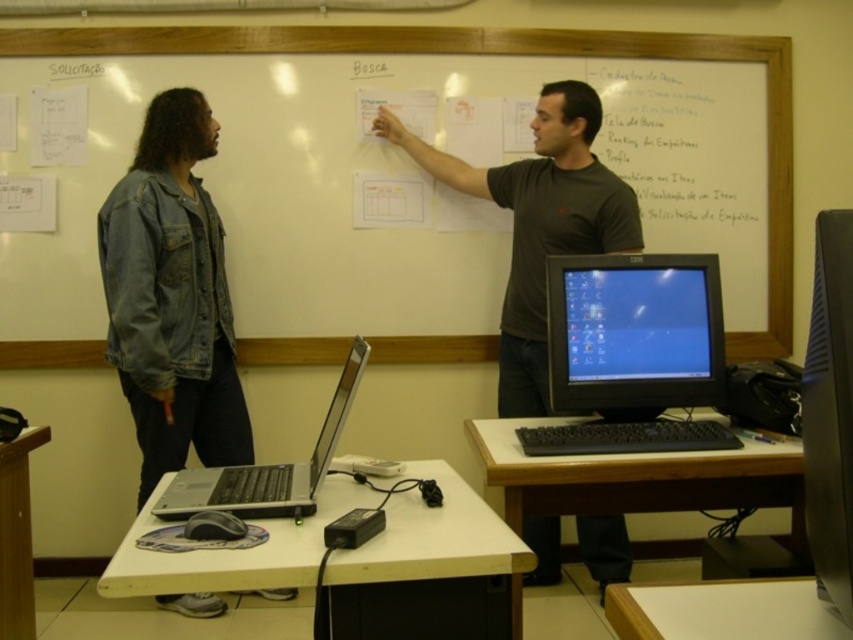
You are a student sitting at the white wood table at lower center and want to reach the white paper at upper center. Can you easily access it without moving your chair?

The white wood table at lower center is behind the white paper at upper center, so you can easily reach the white paper at upper center without needing to move your chair.

You are a student trying to place a 10cm by 10cm textbook on the white matte table at lower center. Given that the table has a rectangular surface, can you determine if the textbook will fit on the table?

The question cannot be answered with the provided information because the dimensions of the white matte table at lower center are not specified in the objects description.

You are a student in the classroom and need to place a textbook on the white paper at upper center and the white wood table at lower center. Which surface is to the left of the other?

The white paper at upper center is positioned on the left side of the white wood table at lower center.